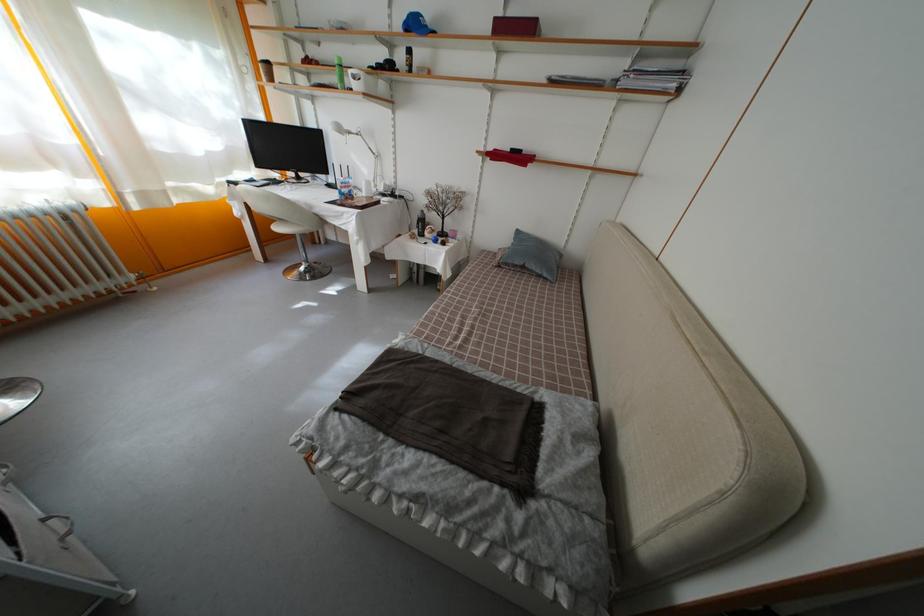
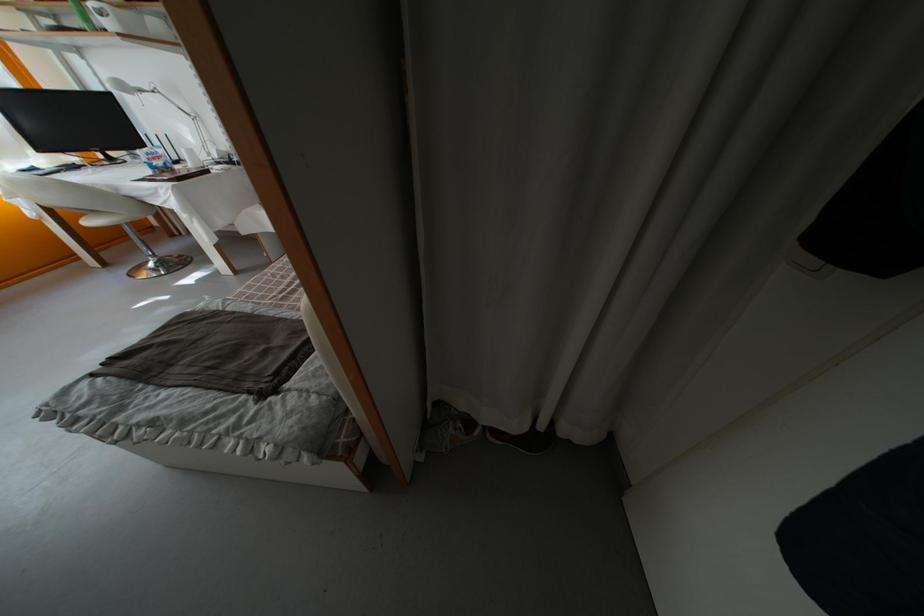
Find the pixel in the second image that matches point (356, 78) in the first image.

(96, 12)